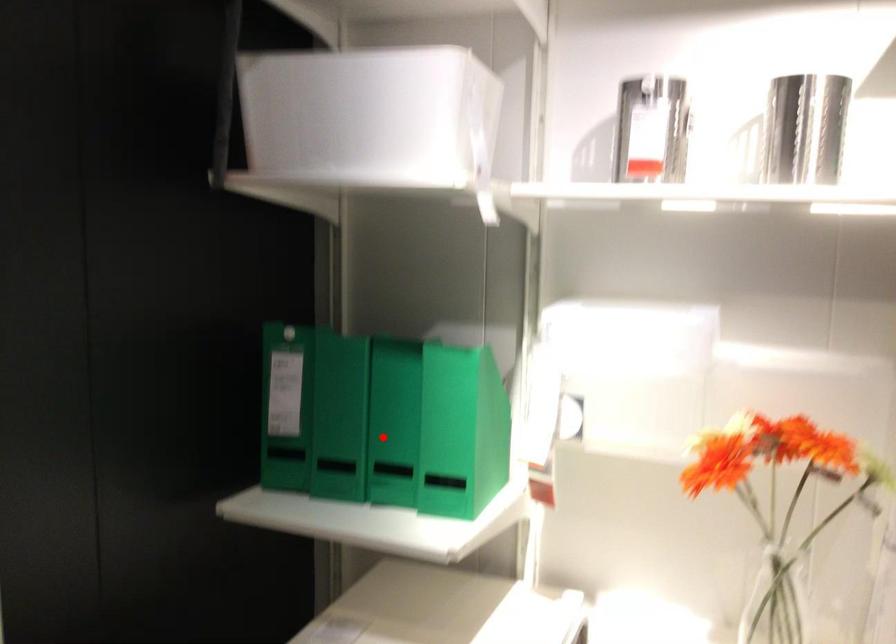
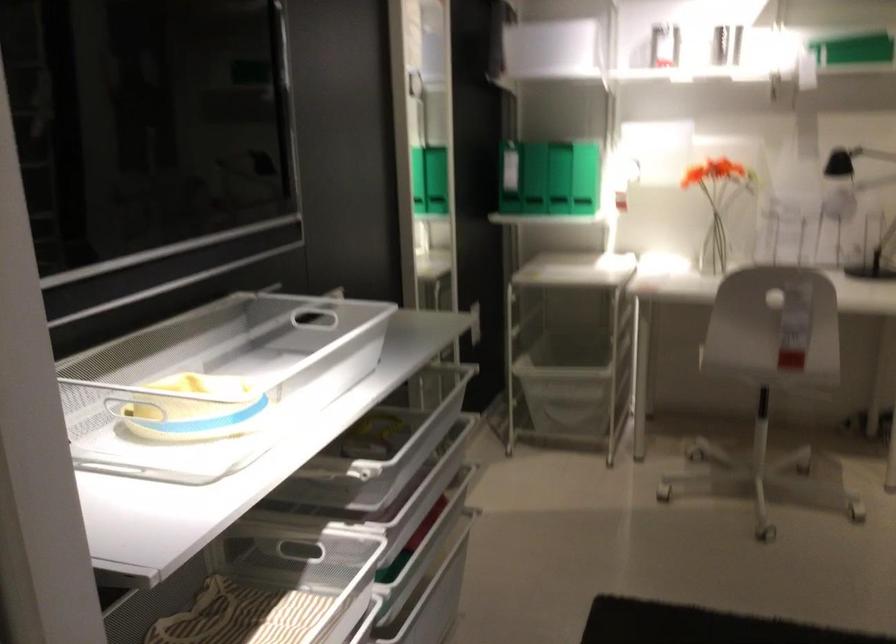
In the second image, find the point that corresponds to the highlighted location in the first image.

(558, 178)